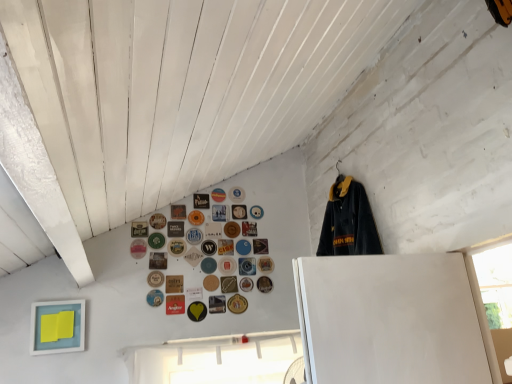
Locate an element on the screen. metallic gold button at upper center, the fifth button in the right-to-left sequence is located at coordinates (249, 229).

Measure the distance between matte brown button at upper center, the second button viewed from the left, and camera.

A distance of 7.52 feet exists between matte brown button at upper center, the second button viewed from the left, and camera.

Where is `brown matte coaster at upper center, the 21th button when ordered from left to right`? brown matte coaster at upper center, the 21th button when ordered from left to right is located at coordinates (211, 283).

This screenshot has width=512, height=384. I want to click on metallic gold button at upper center, the eleventh button in the right-to-left sequence, so click(x=229, y=284).

The image size is (512, 384). Describe the element at coordinates (236, 194) in the screenshot. I see `metallic silver button at upper center, the 28th button viewed from the left` at that location.

Find the location of a particular element. Image resolution: width=512 pixels, height=384 pixels. matte black button at upper center, the sixteenth button when ordered from left to right is located at coordinates pos(201,201).

Is gold metallic button at center, which ranks as the 29th button in left-to-right order, not inside gold metallic button at center, positioned as the 27th button in right-to-left order?

That's correct, gold metallic button at center, which ranks as the 29th button in left-to-right order, is outside of gold metallic button at center, positioned as the 27th button in right-to-left order.

Does gold metallic button at center, acting as the ninth button starting from the right, come behind gold metallic button at center, which ranks as the eleventh button in left-to-right order?

Yes, it is behind gold metallic button at center, which ranks as the eleventh button in left-to-right order.

Can you see gold metallic button at center, which ranks as the 29th button in left-to-right order, touching gold metallic button at center, which ranks as the eleventh button in left-to-right order?

There is a gap between gold metallic button at center, which ranks as the 29th button in left-to-right order, and gold metallic button at center, which ranks as the eleventh button in left-to-right order.

Which of these two, matte yellow paper at lower left or orange matte button at upper center, which is counted as the fourteenth button, starting from the left, is thinner?

orange matte button at upper center, which is counted as the fourteenth button, starting from the left.

What's the angular difference between matte yellow paper at lower left and orange matte button at upper center, which is counted as the fourteenth button, starting from the left,'s facing directions?

The angular difference between matte yellow paper at lower left and orange matte button at upper center, which is counted as the fourteenth button, starting from the left, is 0.0232 degrees.

Are matte yellow paper at lower left and orange matte button at upper center, which is counted as the 24th button, starting from the right, far apart?

They are positioned close to each other.

Is matte yellow paper at lower left smaller than orange matte button at upper center, which is counted as the fourteenth button, starting from the left?

Actually, matte yellow paper at lower left might be larger than orange matte button at upper center, which is counted as the fourteenth button, starting from the left.

Is matte blue button at center, the nineteenth button viewed from the right, looking in the opposite direction of matte black button at center, the 30th button when ordered from right to left?

No, matte blue button at center, the nineteenth button viewed from the right, is not facing away from matte black button at center, the 30th button when ordered from right to left.

Which is less distant, (201, 265) or (176, 225)?

Point (201, 265)

Considering the sizes of objects matte blue button at center, positioned as the 19th button in left-to-right order, and matte black button at center, which is counted as the 8th button, starting from the left, in the image provided, who is taller, matte blue button at center, positioned as the 19th button in left-to-right order, or matte black button at center, which is counted as the 8th button, starting from the left,?

With more height is matte black button at center, which is counted as the 8th button, starting from the left.

Is matte blue button at center, the nineteenth button viewed from the right, not near matte black button at center, the 30th button when ordered from right to left?

matte blue button at center, the nineteenth button viewed from the right, is near matte black button at center, the 30th button when ordered from right to left, not far away.

Which of these two, metallic gold button at upper center, which is the 13th button in right-to-left order, or matte brown coaster at upper center, the 29th button viewed from the right, stands shorter?

With less height is matte brown coaster at upper center, the 29th button viewed from the right.

Who is smaller, metallic gold button at upper center, the 25th button in the left-to-right sequence, or matte brown coaster at upper center, the ninth button viewed from the left?

Smaller between the two is matte brown coaster at upper center, the ninth button viewed from the left.

Find the location of a particular element. This screenshot has width=512, height=384. button that is the 2nd one when counting forward from the metallic gold button at upper center, which is the 13th button in right-to-left order is located at coordinates (178, 212).

Between point (226, 245) and point (174, 205), which one is positioned behind?

Point (226, 245)

Starting from the matte yellow paper at lower left, which button is the 24th one to the right? Please provide its 2D coordinates.

[(219, 213)]

From the image's perspective, is matte yellow paper at lower left located above matte black button at upper center, which is the 24th button in left-to-right order?

Incorrect, from the image's perspective, matte yellow paper at lower left is lower than matte black button at upper center, which is the 24th button in left-to-right order.

Are matte yellow paper at lower left and matte black button at upper center, arranged as the fourteenth button when viewed from the right, located far from each other?

matte yellow paper at lower left is near matte black button at upper center, arranged as the fourteenth button when viewed from the right, not far away.

From a real-world perspective, who is located higher, matte yellow paper at lower left or matte black button at upper center, arranged as the fourteenth button when viewed from the right?

matte black button at upper center, arranged as the fourteenth button when viewed from the right, from a real-world perspective.

Based on their sizes in the image, would you say wooden coaster at center, the 33th button viewed from the right, is bigger or smaller than matte brown button at center, the 26th button viewed from the left?

Clearly, wooden coaster at center, the 33th button viewed from the right, is smaller in size than matte brown button at center, the 26th button viewed from the left.

How different are the orientations of wooden coaster at center, the 33th button viewed from the right, and matte brown button at center, the 26th button viewed from the left, in degrees?

They differ by 0.00365 degrees in their facing directions.

Can you confirm if wooden coaster at center, the 33th button viewed from the right, is wider than matte brown button at center, the 26th button viewed from the left?

No.

Is blue matte button at center, which is counted as the 31th button, starting from the right, in front of or behind matte yellow paper at lower left in the image?

Visually, blue matte button at center, which is counted as the 31th button, starting from the right, is located behind matte yellow paper at lower left.

In terms of width, does blue matte button at center, placed as the 7th button when sorted from left to right, look wider or thinner when compared to matte yellow paper at lower left?

Considering their sizes, blue matte button at center, placed as the 7th button when sorted from left to right, looks slimmer than matte yellow paper at lower left.

Is blue matte button at center, which is counted as the 31th button, starting from the right, with matte yellow paper at lower left?

No.

Is blue matte button at center, placed as the 7th button when sorted from left to right, not inside matte yellow paper at lower left?

Yes.

From the image's perspective, count 8th buttons upward from the gold metallic button at center, which ranks as the 29th button in left-to-right order, and point to it. Please provide its 2D coordinates.

[(174, 284)]

Where is `picture frame lying below the orange matte button at upper center, which is counted as the fourteenth button, starting from the left (from the image's perspective)`? picture frame lying below the orange matte button at upper center, which is counted as the fourteenth button, starting from the left (from the image's perspective) is located at coordinates (57, 327).

Based on their spatial positions, is matte brown button at upper center, the second button viewed from the left, or matte plastic button at upper center, arranged as the 4th button when viewed from the right, closer to blue fabric button at upper center, acting as the 25th button starting from the right?

matte brown button at upper center, the second button viewed from the left, is positioned closer to the anchor blue fabric button at upper center, acting as the 25th button starting from the right.

Looking at the image, which one is located further to blue fabric button at upper center, positioned as the 13th button in left-to-right order, metallic gold button at upper center, which is the 33th button in left-to-right order, or brown matte coaster at upper center, the 21th button when ordered from left to right?

metallic gold button at upper center, which is the 33th button in left-to-right order, lies further to blue fabric button at upper center, positioned as the 13th button in left-to-right order, than the other object.

Which object lies nearer to the anchor point blue fabric button at upper center, acting as the 25th button starting from the right, matte yellow paper at lower left or matte black button at upper center, placed as the 22th button when sorted from right to left?

matte black button at upper center, placed as the 22th button when sorted from right to left.

From the image, which object appears to be farther from matte black button at upper center, the sixteenth button when ordered from left to right, yellow matte button at center, the 21th button from the right, or metallic gold button at upper center, the 3th button viewed from the right?

yellow matte button at center, the 21th button from the right, lies further to matte black button at upper center, the sixteenth button when ordered from left to right, than the other object.

Which object lies nearer to the anchor point matte plastic button at upper center, the 34th button viewed from the left, matte yellow paper at lower left or matte blue button at center, placed as the sixth button when sorted from right to left?

matte blue button at center, placed as the sixth button when sorted from right to left.

When comparing their distances from matte yellow paper at lower left, does matte black button at center, the 30th button when ordered from right to left, or metallic gold button at upper center, the eleventh button in the right-to-left sequence, seem closer?

Based on the image, matte black button at center, the 30th button when ordered from right to left, appears to be nearer to matte yellow paper at lower left.

Considering their positions, is gold metallic button at center, positioned as the 27th button in right-to-left order, positioned closer to matte blue button at center, the nineteenth button viewed from the right, than blue matte button at center, placed as the 7th button when sorted from left to right?

gold metallic button at center, positioned as the 27th button in right-to-left order, is positioned closer to the anchor matte blue button at center, the nineteenth button viewed from the right.

Which object lies nearer to the anchor point matte brown button at upper center, which is counted as the 8th button, starting from the right, gold metallic button at center, positioned as the 27th button in right-to-left order, or matte brown button at upper center, the second button viewed from the left?

gold metallic button at center, positioned as the 27th button in right-to-left order.

You are a GUI agent. You are given a task and a screenshot of the screen. Output one action in this format:
    pyautogui.click(x=<x>, y=<y>)
    Task: Click on the window screen situated between wooden coaster at center, the 33th button viewed from the right, and gold metallic button at center, which ranks as the 37th button in left-to-right order, from left to right
    
    Given the screenshot: What is the action you would take?
    pyautogui.click(x=215, y=360)

Identify the location of window screen between matte yellow paper at lower left and gold metallic button at center, acting as the ninth button starting from the right. This screenshot has width=512, height=384. (215, 360).

In order to click on window screen between matte yellow paper at lower left and gold metallic button at center, acting as the 2th button starting from the right in this screenshot , I will do `click(215, 360)`.

Image resolution: width=512 pixels, height=384 pixels. Find the location of `window screen located between metallic gold button at upper center, which appears as the 37th button when viewed from the right, and gold metallic button at center, which ranks as the 37th button in left-to-right order, in the left-right direction`. window screen located between metallic gold button at upper center, which appears as the 37th button when viewed from the right, and gold metallic button at center, which ranks as the 37th button in left-to-right order, in the left-right direction is located at coordinates coord(215,360).